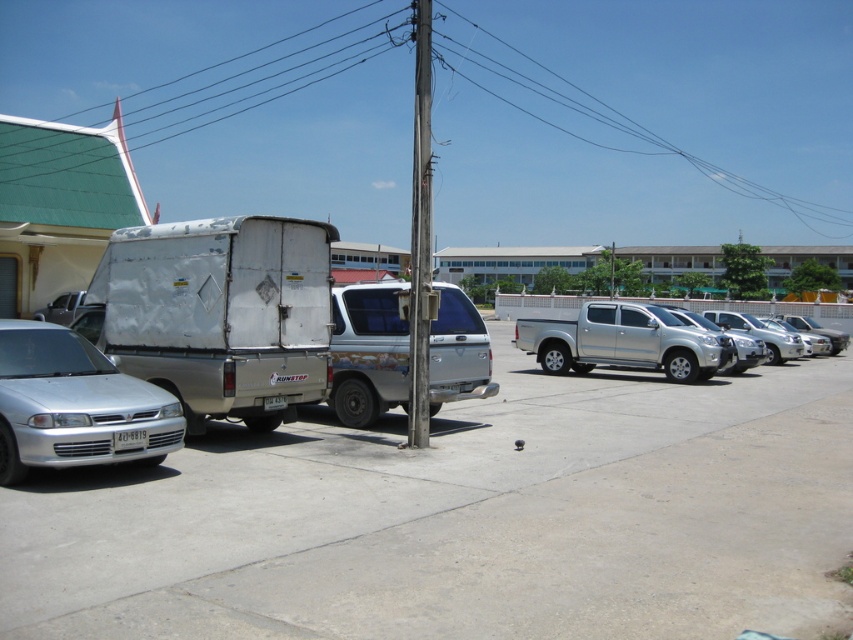
Can you confirm if metallic wire at upper center is taller than weathered wood pole at center?

Yes.

Can you confirm if metallic wire at upper center is smaller than weathered wood pole at center?

No.

Is point (38, 26) more distant than point (415, 182)?

Yes, point (38, 26) is behind point (415, 182).

The height and width of the screenshot is (640, 853). What are the coordinates of `metallic wire at upper center` in the screenshot? It's located at (642, 122).

The height and width of the screenshot is (640, 853). What do you see at coordinates (421, 234) in the screenshot?
I see `weathered wood pole at center` at bounding box center [421, 234].

Can you confirm if weathered wood pole at center is thinner than silver metallic sedan at right?

Yes, weathered wood pole at center is thinner than silver metallic sedan at right.

Is point (426, 220) farther from viewer compared to point (741, 317)?

That is False.

Find the location of a particular element. This screenshot has height=640, width=853. weathered wood pole at center is located at coordinates (421, 234).

Is silver metallic pickup truck at center behind silver metallic truck at center-right?

No, it is not.

Between silver metallic pickup truck at center and silver metallic truck at center-right, which one has less height?

Standing shorter between the two is silver metallic pickup truck at center.

This screenshot has height=640, width=853. I want to click on silver metallic pickup truck at center, so click(x=624, y=340).